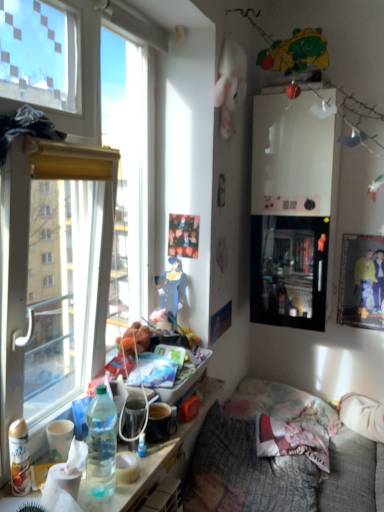
Question: Considering the positions of textured gray fabric couch at lower right and blue denim dress at center in the image, is textured gray fabric couch at lower right wider or thinner than blue denim dress at center?

Choices:
 (A) wide
 (B) thin

Answer: (A)

Question: Visually, is textured gray fabric couch at lower right positioned to the left or to the right of blue denim dress at center?

Choices:
 (A) left
 (B) right

Answer: (B)

Question: Considering the real-world distances, which object is farthest from the textured gray fabric couch at lower right?

Choices:
 (A) plush green bear at upper right
 (B) metallic glossy picture frame at upper right
 (C) blue denim dress at center
 (D) translucent plastic water bottle at lower left
 (E) fluffy fabric pillow at lower center

Answer: (A)

Question: Based on their relative distances, which object is farther from the metallic glossy picture frame at upper right?

Choices:
 (A) blue denim dress at center
 (B) fluffy fabric pillow at lower center
 (C) plush green bear at upper right
 (D) translucent plastic water bottle at lower left
 (E) textured gray fabric couch at lower right

Answer: (C)